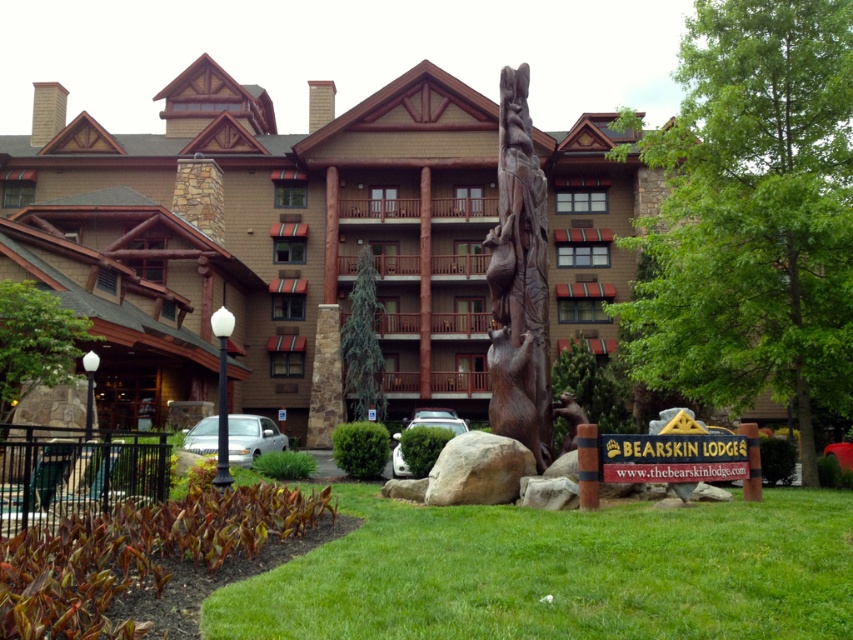
Which of these two, white ceramic lamp post at left or green textured tree at center, stands taller?

green textured tree at center

Is white ceramic lamp post at left wider than green textured tree at center?

In fact, white ceramic lamp post at left might be narrower than green textured tree at center.

Who is more forward, (x=1, y=317) or (x=381, y=417)?

Point (x=1, y=317) is more forward.

The image size is (853, 640). I want to click on white ceramic lamp post at left, so click(35, 342).

Between brown wooden hotel at center and wooden carving of bear at center, which one is positioned higher?

Positioned higher is brown wooden hotel at center.

What do you see at coordinates (263, 241) in the screenshot?
I see `brown wooden hotel at center` at bounding box center [263, 241].

Does point (459, 97) lie in front of point (505, 202)?

No, (459, 97) is further to viewer.

Locate an element on the screen. brown wooden hotel at center is located at coordinates (263, 241).

Is brown wooden hotel at center thinner than green leafy tree at center?

No, brown wooden hotel at center is not thinner than green leafy tree at center.

Is point (331, 269) positioned behind point (729, 397)?

Yes, point (331, 269) is farther from viewer.

This screenshot has width=853, height=640. What are the coordinates of `brown wooden hotel at center` in the screenshot? It's located at (263, 241).